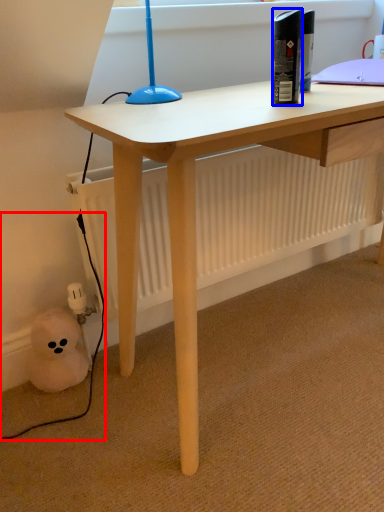
Question: Which object is closer to the camera taking this photo, cable (highlighted by a red box) or bottle (highlighted by a blue box)?

Choices:
 (A) cable
 (B) bottle

Answer: (B)